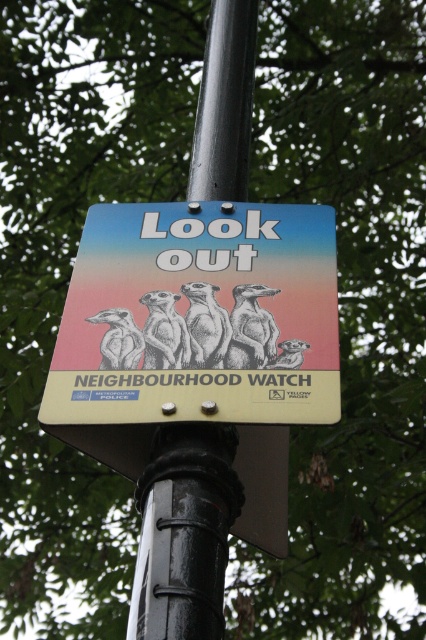
In the scene shown: You are a city planner evaluating the visibility of the matte plastic sign at center and the black metal pole at center in the image. Which object is bigger?

The matte plastic sign at center is larger in size than the black metal pole at center.

You are a pedestrian walking past the matte plastic sign at center and the black metal pole at center. Which object is positioned to the right?

The black metal pole at center is positioned to the right of the matte plastic sign at center.